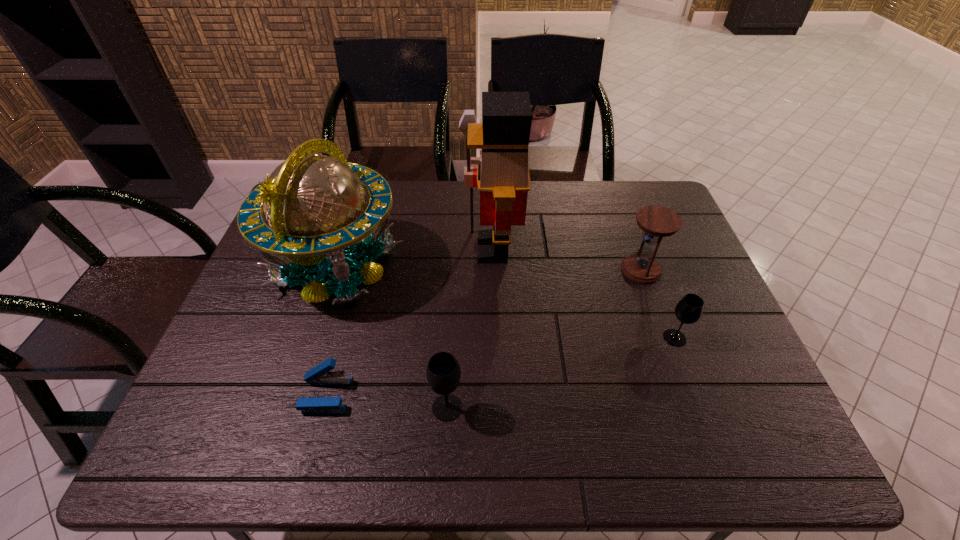
The width and height of the screenshot is (960, 540). I want to click on free space between the taller wineglass and the nutcracker, so click(469, 328).

This screenshot has width=960, height=540. I want to click on free point between the shortest object and the second tallest object, so click(331, 330).

At what (x,y) coordinates should I click in order to perform the action: click on vacant space that is in between the taller wineglass and the stapler. Please return your answer as a coordinate pair (x, y). Looking at the image, I should click on (387, 401).

Locate an element on the screen. empty space between the taller wineglass and the globe is located at coordinates (392, 337).

Identify which object is the fifth nearest to the left wineglass. Please provide its 2D coordinates. Your answer should be formatted as a tuple, i.e. [(x, y)], where the tuple contains the x and y coordinates of a point satisfying the conditions above.

[(657, 222)]

You are a GUI agent. You are given a task and a screenshot of the screen. Output one action in this format:
    pyautogui.click(x=<x>, y=<y>)
    Task: Click on the third closest object to the right wineglass
    Image resolution: width=960 pixels, height=540 pixels.
    Given the screenshot: What is the action you would take?
    pyautogui.click(x=443, y=373)

Identify the location of free region that satisfies the following two spatial constraints: 1. in front of the hourglass holding the staff; 2. on the left side of the tallest object. (492, 269).

At what (x,y) coordinates should I click in order to perform the action: click on free location that satisfies the following two spatial constraints: 1. in front of the nutcracker holding the staff; 2. on the right side of the shorter wineglass. Please return your answer as a coordinate pair (x, y). Image resolution: width=960 pixels, height=540 pixels. Looking at the image, I should click on (495, 338).

In order to click on vacant region that satisfies the following two spatial constraints: 1. on the back side of the hourglass; 2. on the right side of the shortest object in this screenshot , I will do `click(360, 269)`.

Where is `vacant region that satisfies the following two spatial constraints: 1. on the front side of the stapler; 2. on the left side of the left wineglass`? Image resolution: width=960 pixels, height=540 pixels. vacant region that satisfies the following two spatial constraints: 1. on the front side of the stapler; 2. on the left side of the left wineglass is located at coordinates (323, 408).